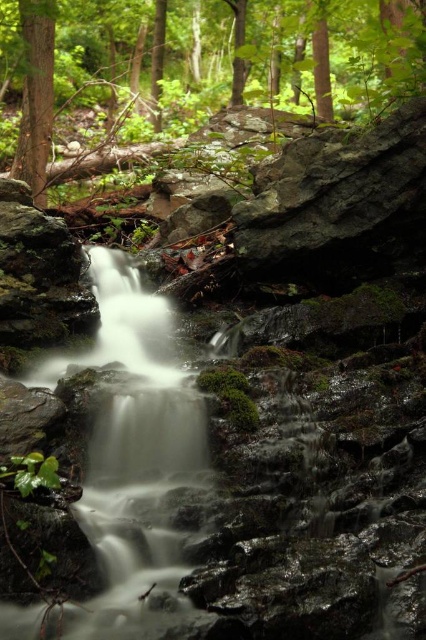
You are standing at the point labeled point (2, 45) and want to reach the other side of the forest. The forest is 13.27 meters wide. If your average walking speed is 1.5 meters per second, how long will it take you to cross the forest?

The forest is 13.27 meters wide, and your walking speed is 1.5 meters per second. To calculate the time, divide the distance by speed. 13.27 meters divided by 1.5 meters per second equals approximately 8.85 seconds. Therefore, it will take about 9 seconds to cross the forest.

You are a hiker trying to identify the largest tree in the forest. Based on the image, which tree trunk is larger between the green matte tree trunk at center and the smooth brown tree trunk at upper left?

The green matte tree trunk at center is bigger than the smooth brown tree trunk at upper left, so the largest tree trunk is the green matte tree trunk at center.

You are a hiker trying to determine which tree trunk is wider between the green matte tree trunk at center and the smooth brown tree trunk at upper left. Based on the scene, which one is wider?

The green matte tree trunk at center is wider than the smooth brown tree trunk at upper left.